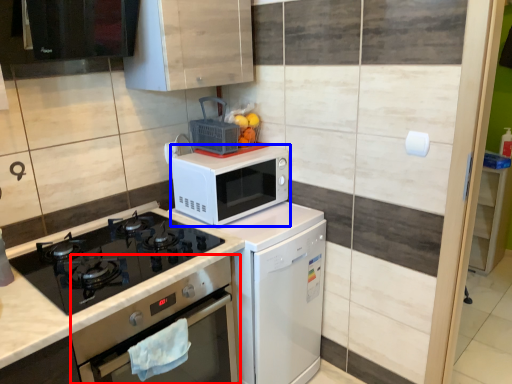
Question: Which object appears farthest to the camera in this image, oven (highlighted by a red box) or microwave oven (highlighted by a blue box)?

Choices:
 (A) oven
 (B) microwave oven

Answer: (B)